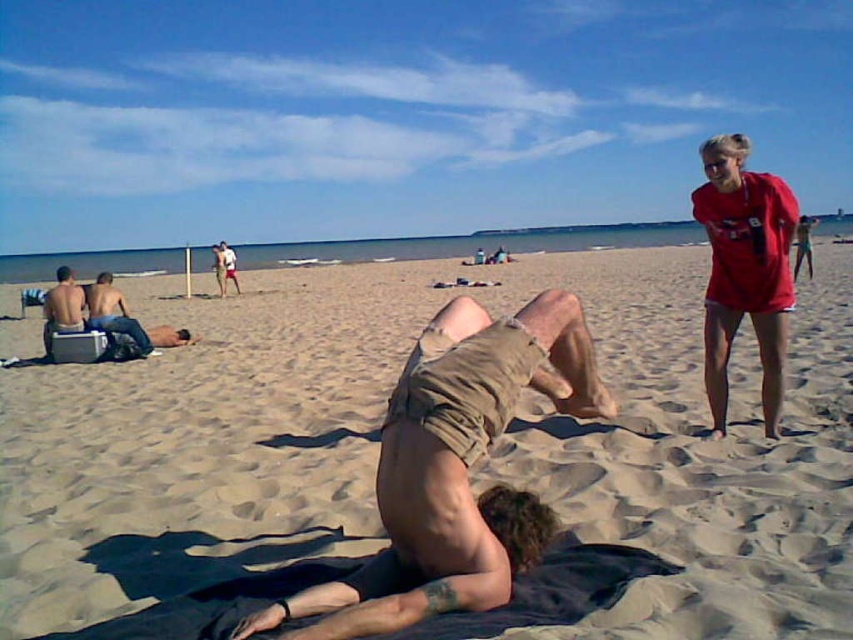
Can you confirm if smooth tan skin at center is taller than light brown skin at center?

Correct, smooth tan skin at center is much taller as light brown skin at center.

Can you confirm if smooth tan skin at center is shorter than light brown skin at center?

No, smooth tan skin at center is not shorter than light brown skin at center.

This screenshot has width=853, height=640. Identify the location of smooth tan skin at center. (744, 269).

Can you confirm if beige sand at center is positioned to the left of brown cotton shorts at center?

Incorrect, beige sand at center is not on the left side of brown cotton shorts at center.

Who is shorter, beige sand at center or brown cotton shorts at center?

With less height is brown cotton shorts at center.

Locate an element on the screen. This screenshot has height=640, width=853. beige sand at center is located at coordinates click(474, 474).

Is brown cotton shorts at center positioned in front of light brown skin at center?

Yes, brown cotton shorts at center is in front of light brown skin at center.

Where is `brown cotton shorts at center`? Image resolution: width=853 pixels, height=640 pixels. brown cotton shorts at center is located at coordinates (456, 468).